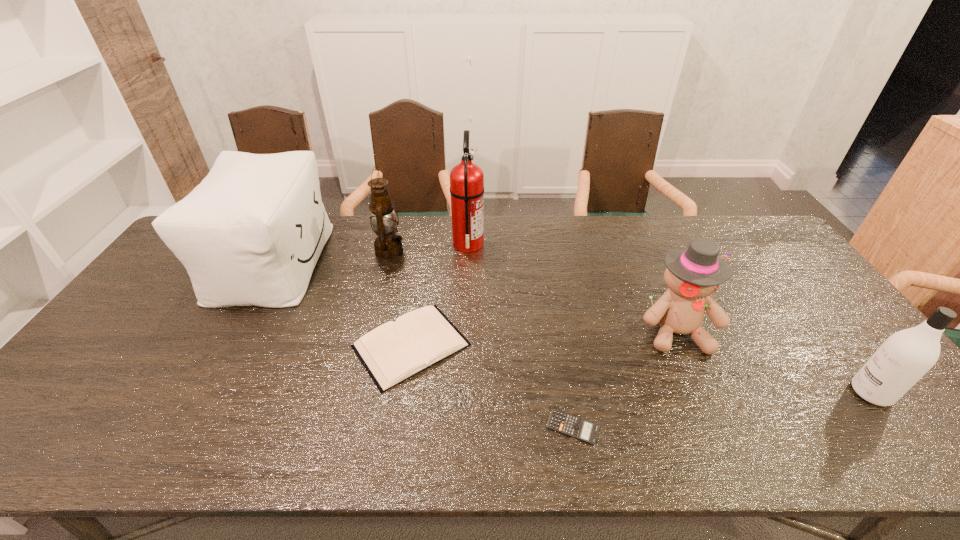
The height and width of the screenshot is (540, 960). What are the coordinates of `free spot located 0.090m on the back of the oil lamp` in the screenshot? It's located at (396, 225).

The width and height of the screenshot is (960, 540). Identify the location of free region located on the front-facing side of the second object from right to left. (715, 420).

The width and height of the screenshot is (960, 540). In order to click on free space located 0.230m on the front-facing side of the rightmost object in this screenshot , I will do pos(757,393).

Where is `blank space located on the front-facing side of the rightmost object`? Image resolution: width=960 pixels, height=540 pixels. blank space located on the front-facing side of the rightmost object is located at coordinates (724, 393).

Locate an element on the screen. The width and height of the screenshot is (960, 540). free space located 0.340m on the front-facing side of the rightmost object is located at coordinates (711, 393).

I want to click on free space located 0.150m on the front of the second shortest object, so click(395, 453).

Locate an element on the screen. vacant space located on the back of the third object from right to left is located at coordinates (566, 392).

Where is `fire extinguisher that is at the far edge`? fire extinguisher that is at the far edge is located at coordinates (466, 179).

You are a GUI agent. You are given a task and a screenshot of the screen. Output one action in this format:
    pyautogui.click(x=<x>, y=<y>)
    Task: Click on the cushion that is at the far edge
    Image resolution: width=960 pixels, height=540 pixels.
    Given the screenshot: What is the action you would take?
    (250, 234)

Identify the location of oil lamp present at the far edge. The width and height of the screenshot is (960, 540). click(x=388, y=246).